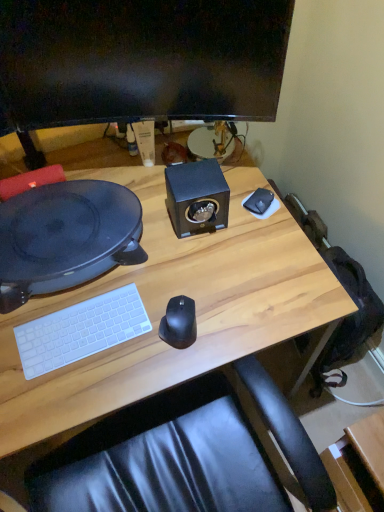
Where is `free space in front of black matte mouse at center`? Image resolution: width=384 pixels, height=512 pixels. free space in front of black matte mouse at center is located at coordinates (166, 369).